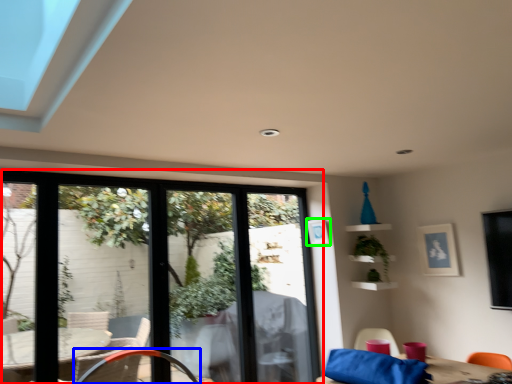
Question: Which is farther away from window (highlighted by a red box)? chair (highlighted by a blue box) or picture frame (highlighted by a green box)?

Choices:
 (A) chair
 (B) picture frame

Answer: (B)